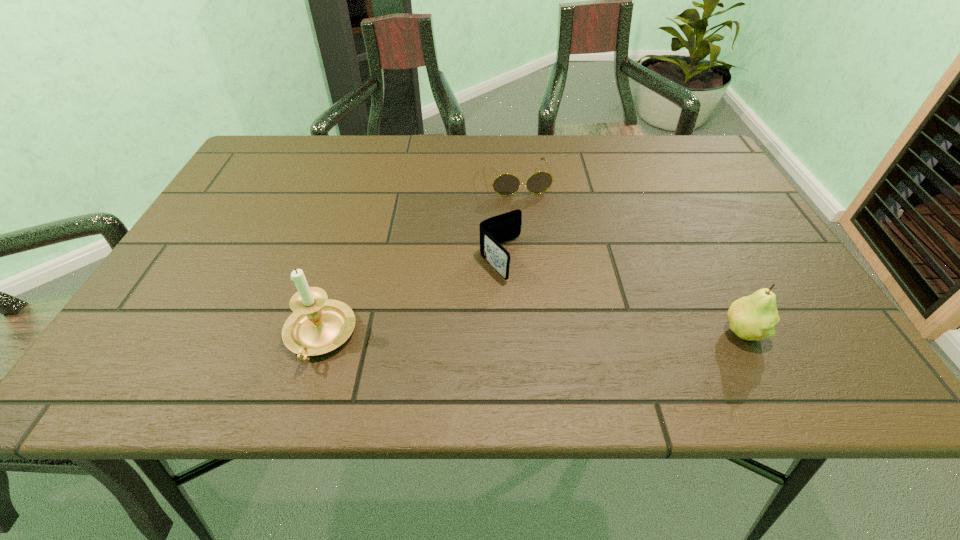
In order to click on vacant space on the desktop that is between the tallest object and the pear and is positioned on the outer surface of the second shortest object in this screenshot , I will do `click(571, 334)`.

The width and height of the screenshot is (960, 540). Identify the location of vacant space on the desktop that is between the candle holder and the rightmost object and is positioned on the lenses of the farthest object. (566, 334).